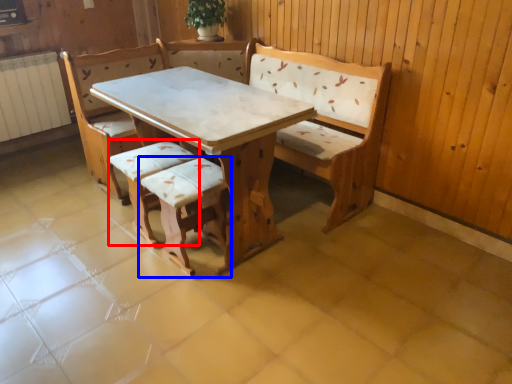
Question: Which of the following is the closest to the observer, armchair (highlighted by a red box) or armchair (highlighted by a blue box)?

Choices:
 (A) armchair
 (B) armchair

Answer: (B)